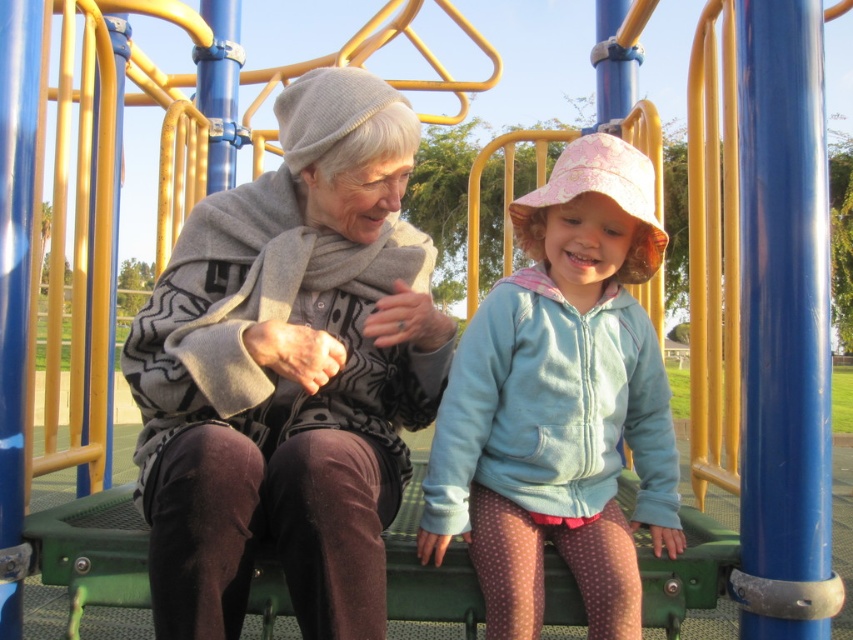
Question: Is knitted gray hat at upper left thinner than light blue fleece jacket at center?

Choices:
 (A) yes
 (B) no

Answer: (B)

Question: Which point is farther to the camera?

Choices:
 (A) (669, 445)
 (B) (202, 436)

Answer: (A)

Question: Does knitted gray hat at upper left have a lesser width compared to light blue fleece jacket at center?

Choices:
 (A) yes
 (B) no

Answer: (B)

Question: Which of the following is the closest to the observer?

Choices:
 (A) (247, 272)
 (B) (659, 403)

Answer: (B)

Question: In this image, where is knitted gray hat at upper left located relative to light blue fleece jacket at center?

Choices:
 (A) below
 (B) above

Answer: (B)